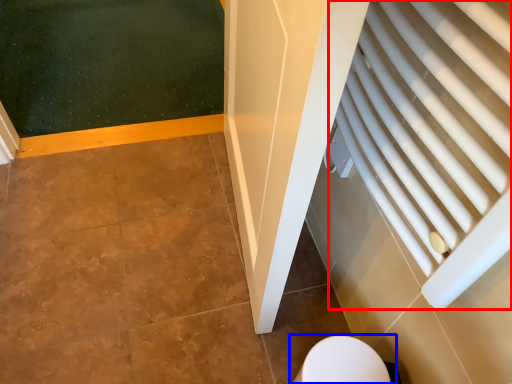
Question: Among these objects, which one is nearest to the camera, curtain (highlighted by a red box) or toilet (highlighted by a blue box)?

Choices:
 (A) curtain
 (B) toilet

Answer: (A)